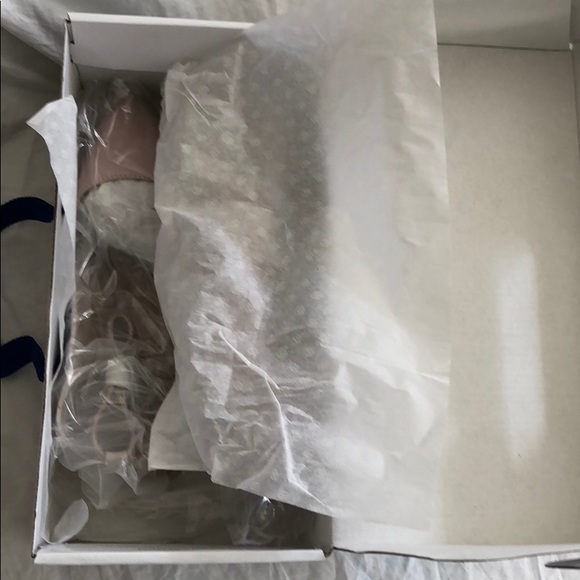
Identify the location of carpet. (36, 264).